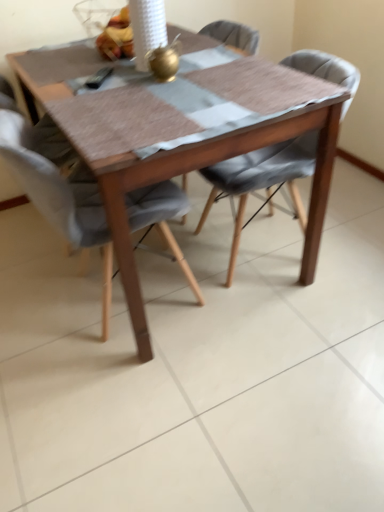
Identify the location of empty space that is ontop of textured gray cushioned chair at center, the 1th chair positioned from the right (from a real-world perspective). The width and height of the screenshot is (384, 512). (263, 74).